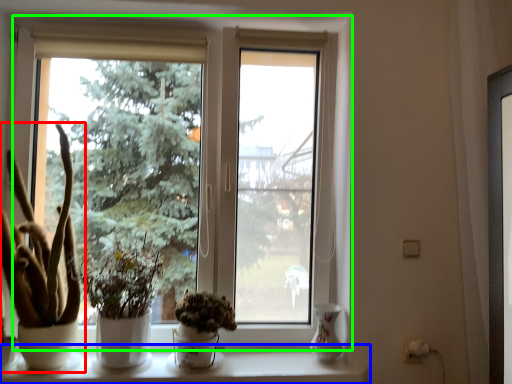
Question: Based on their relative distances, which object is farther from houseplant (highlighted by a red box)? Choose from window sill (highlighted by a blue box) and window (highlighted by a green box).

Choices:
 (A) window sill
 (B) window

Answer: (B)